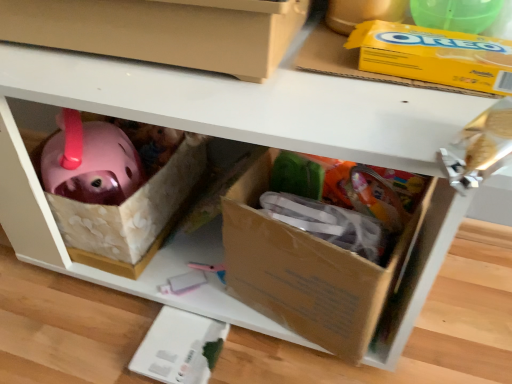
Identify the location of free point in front of yellow cardboard box at upper right. The width and height of the screenshot is (512, 384). (431, 114).